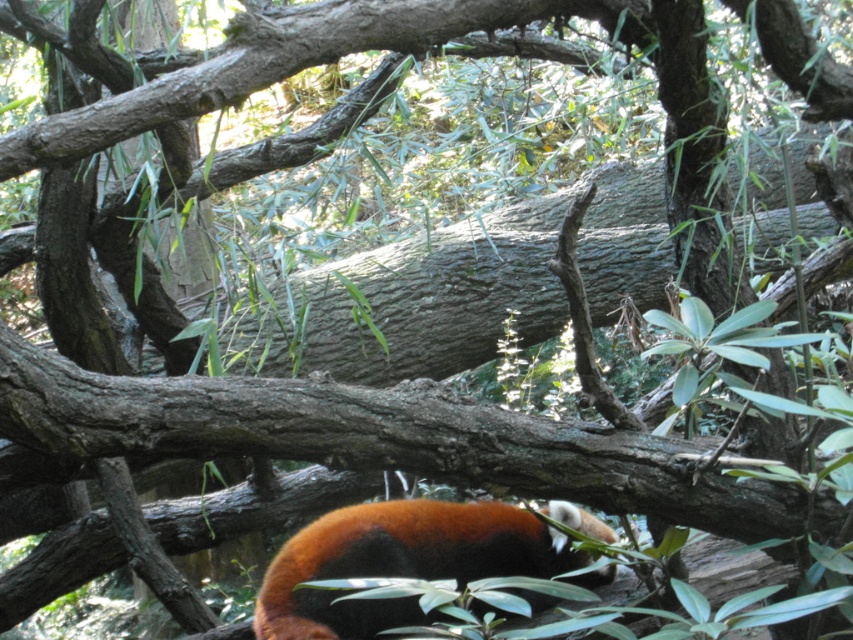
You are standing at the point marked as point (x=410, y=301) in the image. What object are you currently standing on?

You are standing on the gray textured log at center located at point (x=410, y=301).